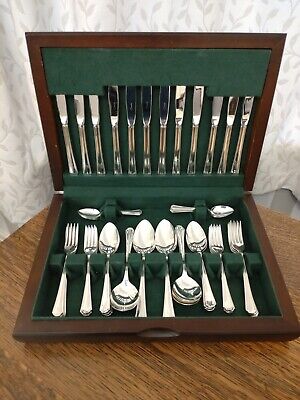
The image size is (300, 400). In order to click on spoons in this screenshot , I will do `click(96, 213)`, `click(221, 207)`, `click(200, 237)`, `click(186, 288)`, `click(167, 243)`, `click(151, 238)`, `click(122, 294)`, `click(108, 243)`.